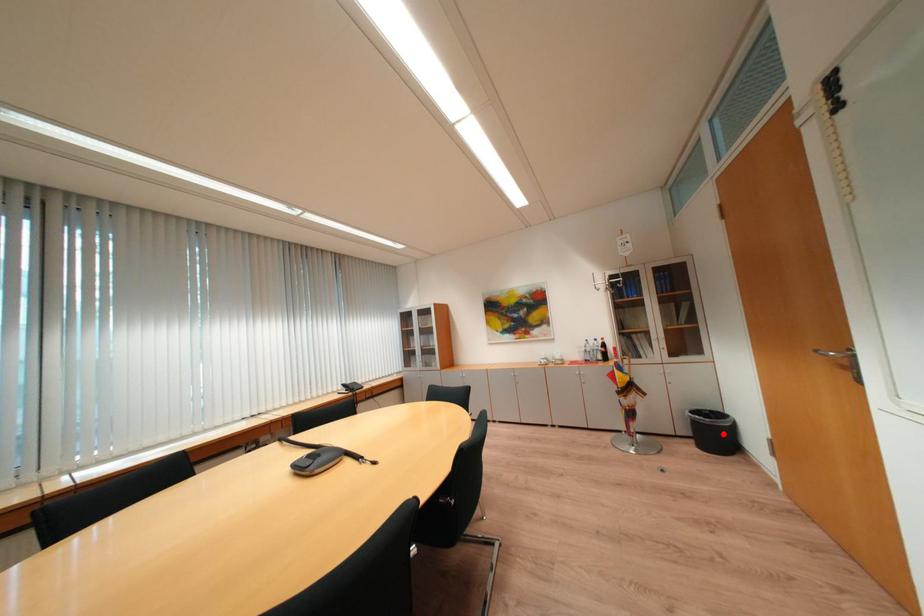
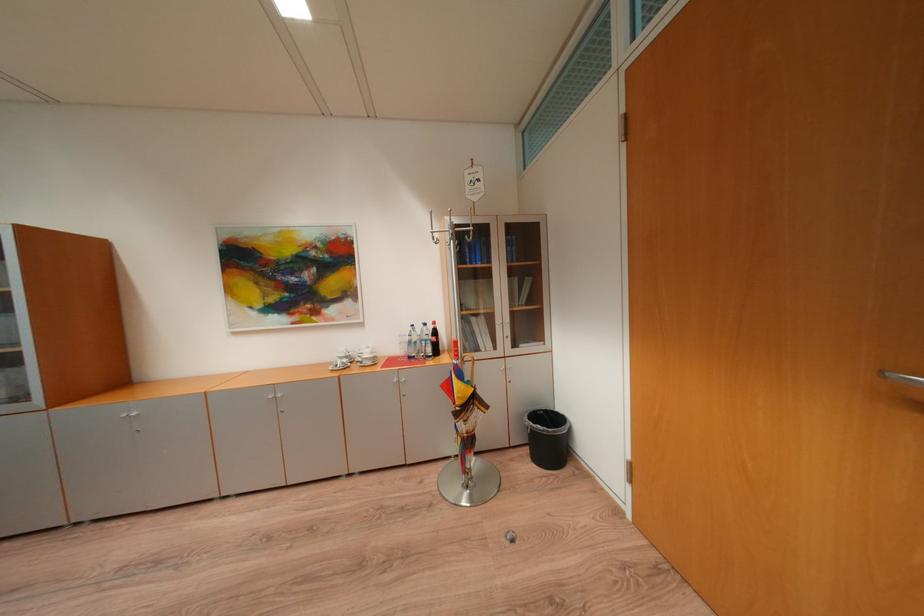
Question: I am providing you with two images of the same scene from different viewpoints. Image1 has a red point marked. In image2, the corresponding 3D location appears at what relative position? Reply with the corresponding letter.

Choices:
 (A) Closer
 (B) Farther

Answer: (B)